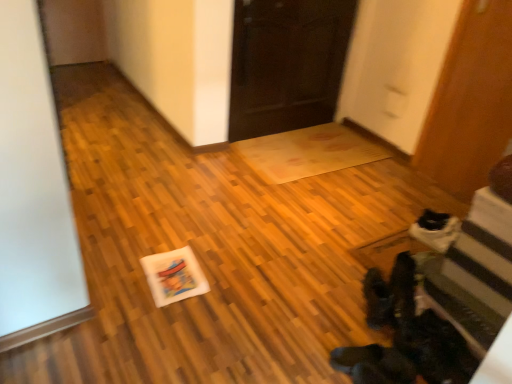
Find the location of a particular element. This screenshot has width=512, height=384. free location above black suede boots at lower right (from a real-world perspective) is located at coordinates coord(385,292).